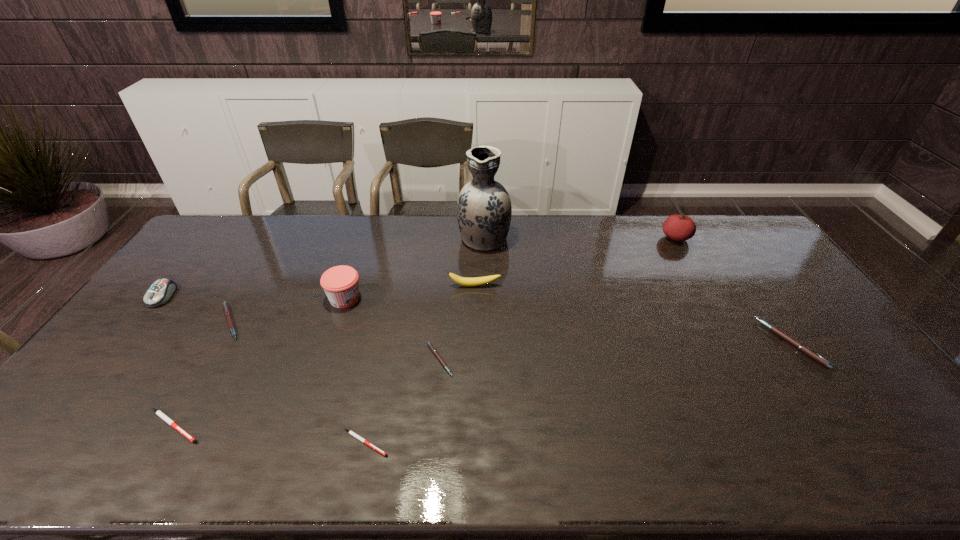
At what (x,y) coordinates should I click in order to perform the action: click on vacant area located 0.190m on the upward curve of the fourth tallest object. Please return your answer as a coordinate pair (x, y). Looking at the image, I should click on (473, 332).

Where is `blank area located on the wheel side of the sixth shortest object`? The width and height of the screenshot is (960, 540). blank area located on the wheel side of the sixth shortest object is located at coordinates (103, 372).

Find the location of a particular element. free region located 0.290m at the nib of the rightmost pink pen is located at coordinates (667, 343).

The width and height of the screenshot is (960, 540). Identify the location of blank area located at the nib of the rightmost pink pen. (667, 343).

You are a GUI agent. You are given a task and a screenshot of the screen. Output one action in this format:
    pyautogui.click(x=<x>, y=<y>)
    Task: Click on the vacant space located at the nib of the rightmost pink pen
    
    Given the screenshot: What is the action you would take?
    pyautogui.click(x=733, y=343)

I want to click on free space located at the nib of the fourth shortest pen, so click(267, 322).

The image size is (960, 540). In order to click on blank space located at the nib of the smallest pink pen in this screenshot , I will do `click(508, 360)`.

At what (x,y) coordinates should I click in order to perform the action: click on vacant position located 0.190m on the clicker of the left white pen. Please return your answer as a coordinate pair (x, y). Looking at the image, I should click on (284, 426).

Locate an element on the screen. vacant region located on the clicker of the shortest object is located at coordinates (420, 443).

The width and height of the screenshot is (960, 540). In order to click on vase that is at the far edge in this screenshot , I will do `click(483, 210)`.